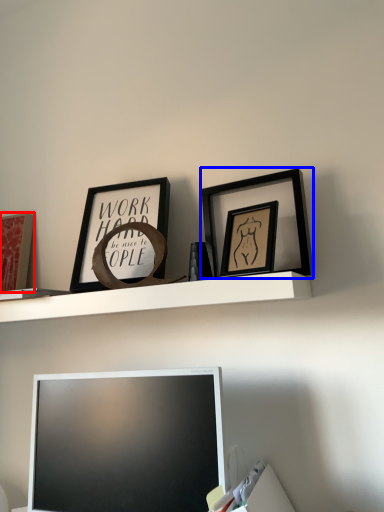
Question: Which object is closer to the camera taking this photo, picture frame (highlighted by a red box) or picture frame (highlighted by a blue box)?

Choices:
 (A) picture frame
 (B) picture frame

Answer: (B)